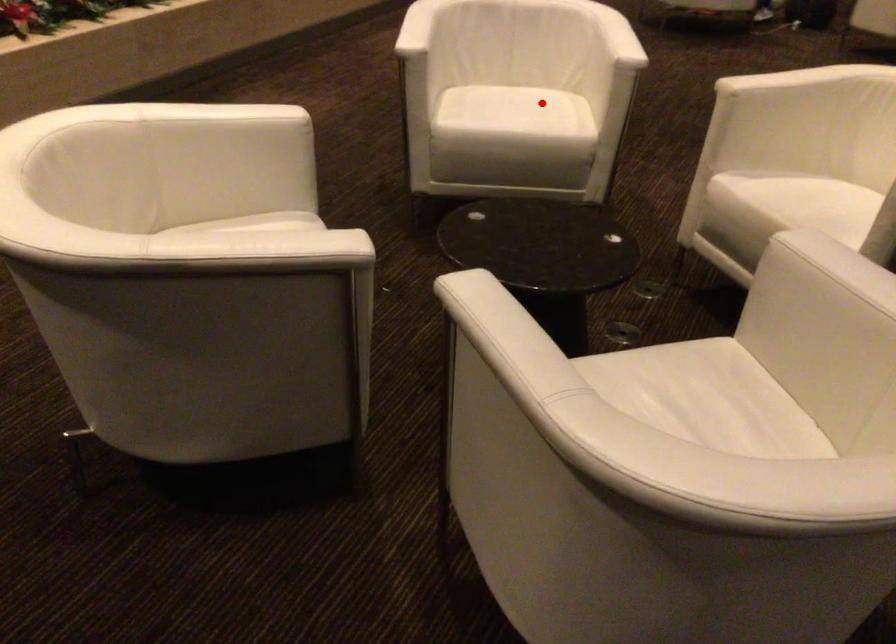
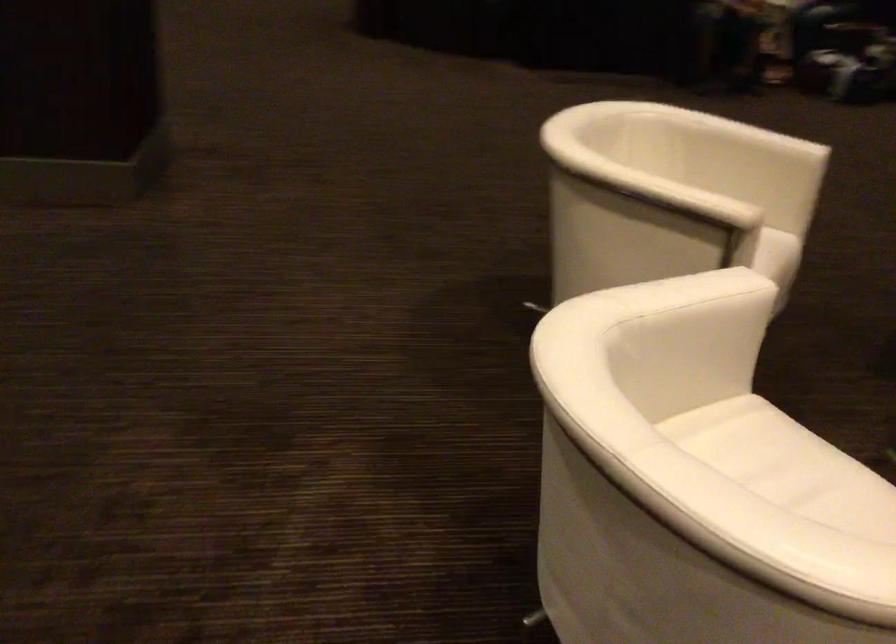
Question: A red point is marked in image1. In image2, is the corresponding 3D point closer to the camera or farther? Reply with the corresponding letter.

Choices:
 (A) The corresponding 3D point is closer.
 (B) The corresponding 3D point is farther.

Answer: (A)